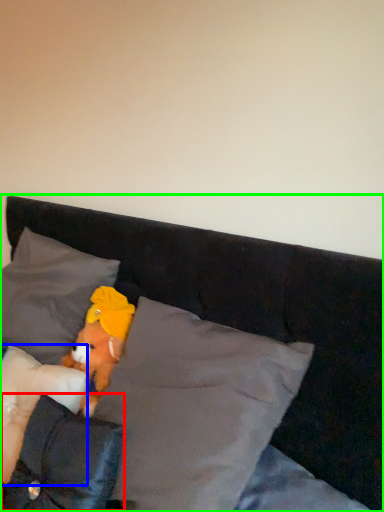
Question: Which is nearer to the pillow (highlighted by a red box)? pillow (highlighted by a blue box) or bed (highlighted by a green box).

Choices:
 (A) pillow
 (B) bed

Answer: (A)